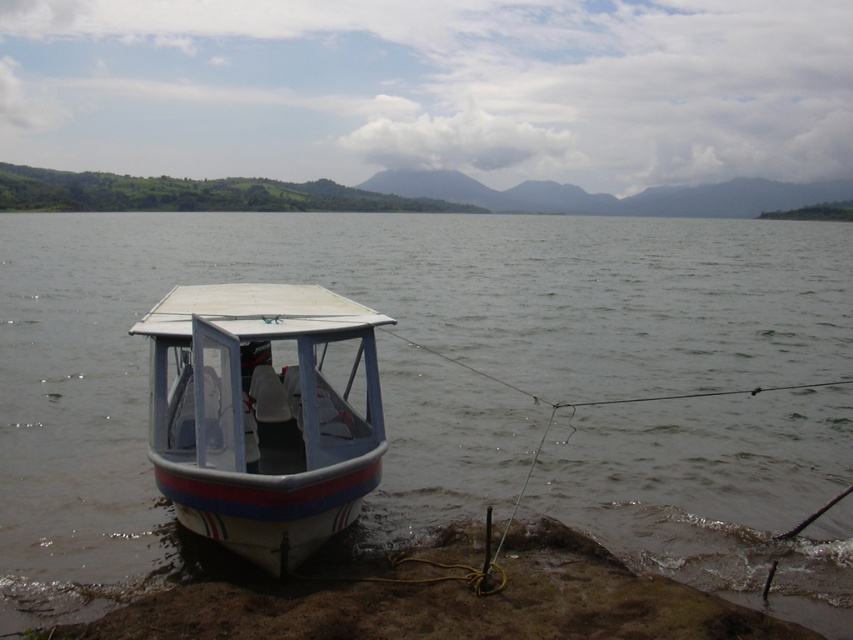
Who is more distant from viewer, [735,440] or [262,509]?

Point [735,440]

Which is below, clear water at boat left or white matte boat at center?

Positioned lower is white matte boat at center.

Identify the location of clear water at boat left. Image resolution: width=853 pixels, height=640 pixels. (460, 387).

What are the coordinates of `clear water at boat left` in the screenshot? It's located at (460, 387).

Does point (207, 358) lie in front of point (579, 596)?

No, (207, 358) is behind (579, 596).

Describe the element at coordinates (260, 417) in the screenshot. The width and height of the screenshot is (853, 640). I see `white matte boat at center` at that location.

I want to click on white matte boat at center, so click(x=260, y=417).

How distant is clear water at boat left from muddy sand at lower left?

They are 21.60 meters apart.

Between clear water at boat left and muddy sand at lower left, which one has less height?

Standing shorter between the two is muddy sand at lower left.

Which is behind, point (386, 227) or point (630, 596)?

Point (386, 227)

Where is `clear water at boat left`? clear water at boat left is located at coordinates (460, 387).